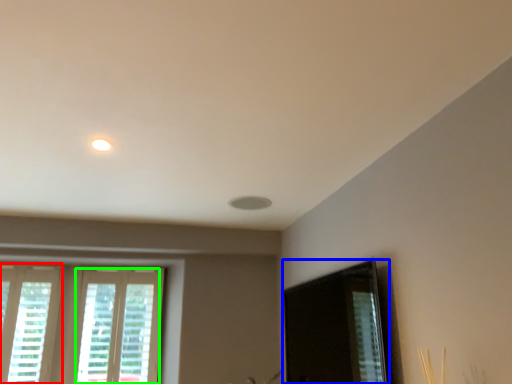
Question: Estimate the real-world distances between objects in this image. Which object is closer to window (highlighted by a red box), screen door (highlighted by a blue box) or window (highlighted by a green box)?

Choices:
 (A) screen door
 (B) window

Answer: (B)